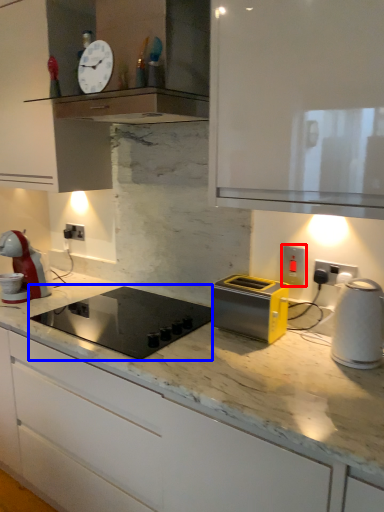
Question: Which object is closer to the camera taking this photo, electric outlet (highlighted by a red box) or home appliance (highlighted by a blue box)?

Choices:
 (A) electric outlet
 (B) home appliance

Answer: (B)